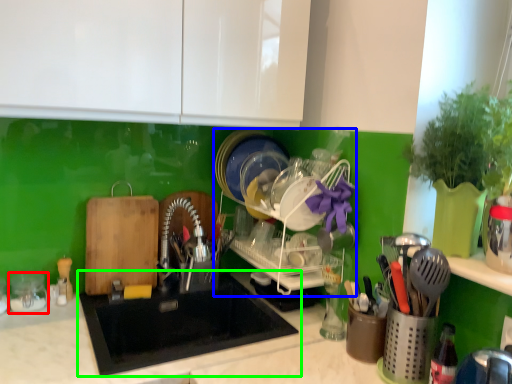
Question: Considering the real-world distances, which object is farthest from tableware (highlighted by a red box)? dish washer (highlighted by a blue box) or sink (highlighted by a green box)?

Choices:
 (A) dish washer
 (B) sink

Answer: (A)